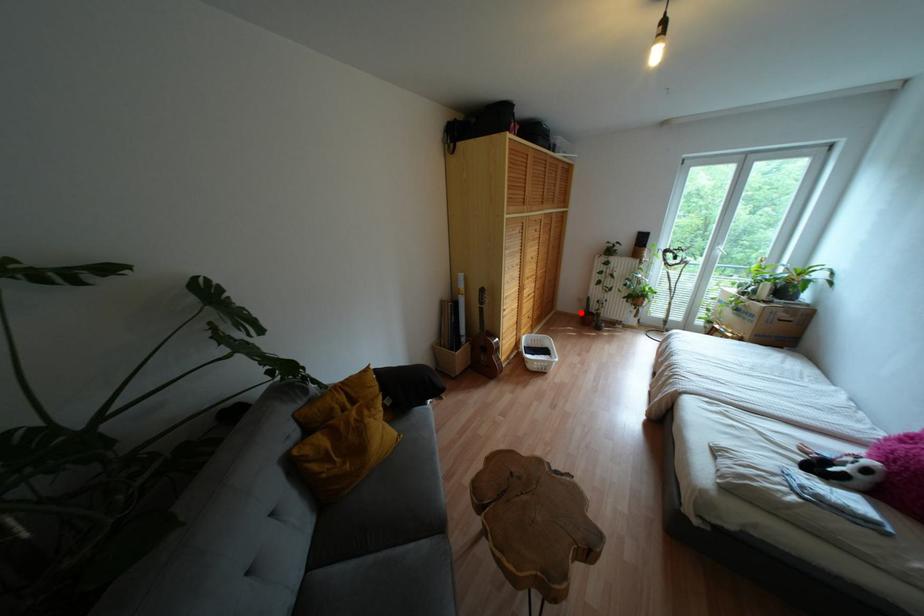
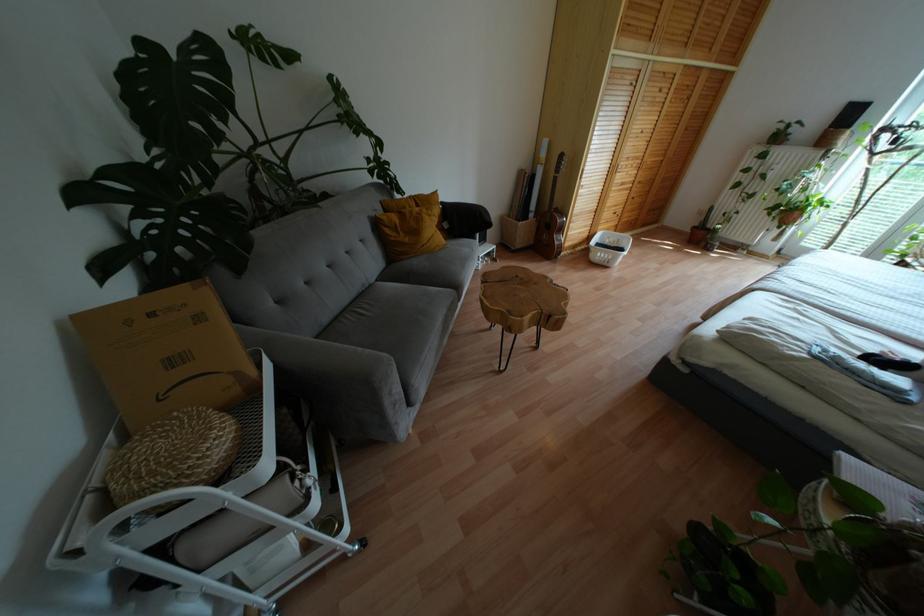
Where in the second image is the point corresponding to the highlighted location from the first image?

(694, 227)